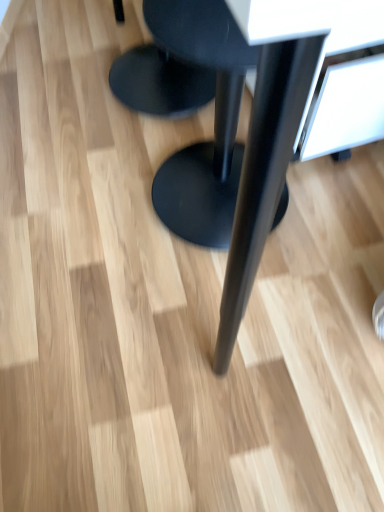
Question: Looking at the image, does black matte stool at center, which is the first stool from top to bottom, seem bigger or smaller compared to black matte stool at center, placed as the 1th stool when sorted from bottom to top?

Choices:
 (A) big
 (B) small

Answer: (B)

Question: In terms of width, does black matte stool at center, which is the first stool from top to bottom, look wider or thinner when compared to black matte stool at center, placed as the 1th stool when sorted from bottom to top?

Choices:
 (A) wide
 (B) thin

Answer: (A)

Question: Estimate the real-world distances between objects in this image. Which object is closer to the black matte table at center?

Choices:
 (A) black matte stool at center, which is the first stool from top to bottom
 (B) black matte stool at center, placed as the 1th stool when sorted from bottom to top

Answer: (B)

Question: Based on their relative distances, which object is nearer to the black matte stool at center, which is the first stool from top to bottom?

Choices:
 (A) black matte stool at center, which is the second stool in top-to-bottom order
 (B) black matte table at center

Answer: (A)